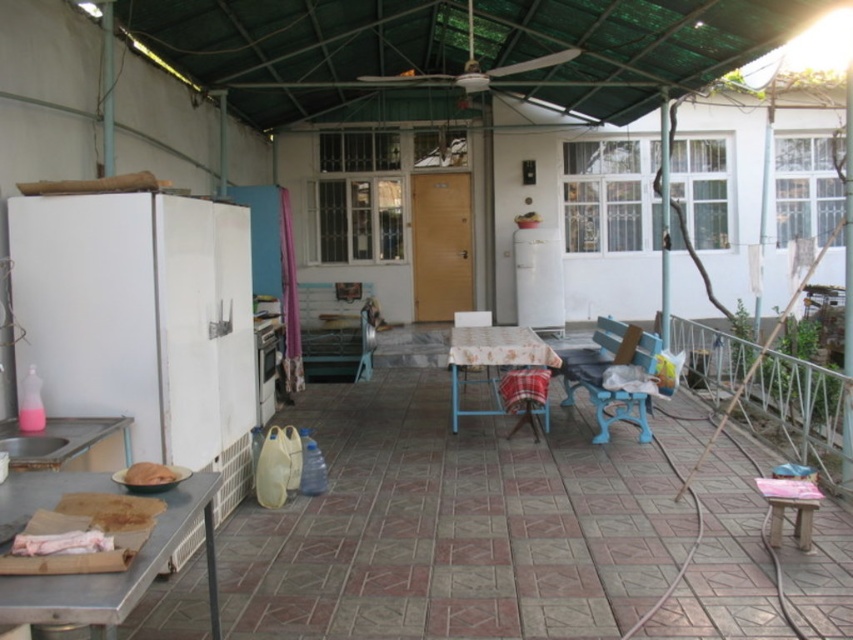
Consider the image. Can you confirm if floral fabric-covered table at center is smaller than white matte refrigerator at center?

No, floral fabric-covered table at center is not smaller than white matte refrigerator at center.

Can you confirm if floral fabric-covered table at center is shorter than white matte refrigerator at center?

Correct, floral fabric-covered table at center is not as tall as white matte refrigerator at center.

Which is behind, point (467, 336) or point (531, 266)?

The point (531, 266) is more distant.

In order to click on floral fabric-covered table at center in this screenshot , I will do coord(491,360).

Between metallic silver table at lower left and wooden bench at center, which one has more height?

With more height is wooden bench at center.

The image size is (853, 640). I want to click on metallic silver table at lower left, so (119, 573).

Identify the location of metallic silver table at lower left. The height and width of the screenshot is (640, 853). (119, 573).

Between green fabric canopy at upper center and blue plastic chair at center, which one has less height?

green fabric canopy at upper center

Is green fabric canopy at upper center positioned at the back of blue plastic chair at center?

Yes, green fabric canopy at upper center is behind blue plastic chair at center.

Which is behind, point (267, 35) or point (612, 352)?

The point (612, 352) is more distant.

What are the coordinates of `green fabric canopy at upper center` in the screenshot? It's located at (308, 52).